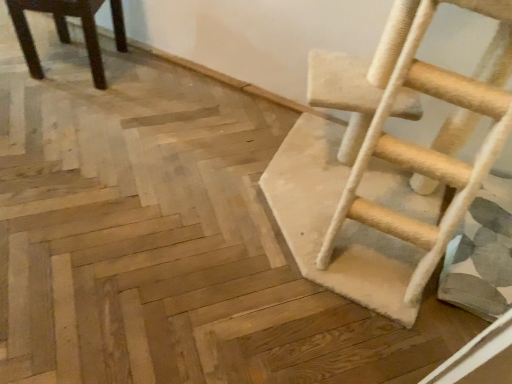
Find the location of `beige carpeted ladder at right`. beige carpeted ladder at right is located at coordinates (418, 146).

Image resolution: width=512 pixels, height=384 pixels. What do you see at coordinates (418, 146) in the screenshot? I see `beige carpeted ladder at right` at bounding box center [418, 146].

In order to face beige carpeted ladder at right, should I rotate leftwards or rightwards?

To face it directly, rotate right by 17.753 degrees.

Image resolution: width=512 pixels, height=384 pixels. I want to click on dark brown wood chair at upper left, so pos(59,31).

Measure the distance between dark brown wood chair at upper left and camera.

A distance of 4.39 feet exists between dark brown wood chair at upper left and camera.

This screenshot has height=384, width=512. Describe the element at coordinates (59, 31) in the screenshot. I see `dark brown wood chair at upper left` at that location.

What are the coordinates of `beige carpeted ladder at right` in the screenshot? It's located at (418, 146).

Is dark brown wood chair at upper left at the left side of beige carpeted ladder at right?

Correct, you'll find dark brown wood chair at upper left to the left of beige carpeted ladder at right.

Is dark brown wood chair at upper left positioned before beige carpeted ladder at right?

That is False.

Which is nearer, (29,59) or (407,234)?

The point (407,234) is in front.

From the image's perspective, is dark brown wood chair at upper left located above beige carpeted ladder at right?

Correct, dark brown wood chair at upper left appears higher than beige carpeted ladder at right in the image.

From a real-world perspective, which object rests below the other?

In real-world perspective, dark brown wood chair at upper left is lower.

Considering the sizes of dark brown wood chair at upper left and beige carpeted ladder at right in the image, is dark brown wood chair at upper left wider or thinner than beige carpeted ladder at right?

Considering their sizes, dark brown wood chair at upper left looks slimmer than beige carpeted ladder at right.

Does dark brown wood chair at upper left have a lesser height compared to beige carpeted ladder at right?

Yes, dark brown wood chair at upper left is shorter than beige carpeted ladder at right.

Considering the sizes of objects dark brown wood chair at upper left and beige carpeted ladder at right in the image provided, who is smaller, dark brown wood chair at upper left or beige carpeted ladder at right?

With smaller size is dark brown wood chair at upper left.

Is dark brown wood chair at upper left inside or outside of beige carpeted ladder at right?

The correct answer is: outside.

Is dark brown wood chair at upper left positioned far away from beige carpeted ladder at right?

Indeed, dark brown wood chair at upper left is not near beige carpeted ladder at right.

Is dark brown wood chair at upper left turned away from beige carpeted ladder at right?

No, dark brown wood chair at upper left's orientation is not away from beige carpeted ladder at right.

How far apart are dark brown wood chair at upper left and beige carpeted ladder at right?

They are 1.06 meters apart.

Locate an element on the screen. This screenshot has height=384, width=512. ladder in front of the dark brown wood chair at upper left is located at coordinates (418, 146).

Which object is positioned more to the left, beige carpeted ladder at right or dark brown wood chair at upper left?

From the viewer's perspective, dark brown wood chair at upper left appears more on the left side.

Is beige carpeted ladder at right closer to the viewer compared to dark brown wood chair at upper left?

That is True.

Is point (490, 143) farther from viewer compared to point (26, 58)?

No, it is in front of (26, 58).

From the image's perspective, which object appears higher, beige carpeted ladder at right or dark brown wood chair at upper left?

dark brown wood chair at upper left appears higher in the image.

From a real-world perspective, is beige carpeted ladder at right above or below dark brown wood chair at upper left?

From a real-world perspective, beige carpeted ladder at right is physically above dark brown wood chair at upper left.

Does beige carpeted ladder at right have a lesser width compared to dark brown wood chair at upper left?

Incorrect, the width of beige carpeted ladder at right is not less than that of dark brown wood chair at upper left.

Considering the relative sizes of beige carpeted ladder at right and dark brown wood chair at upper left in the image provided, is beige carpeted ladder at right taller than dark brown wood chair at upper left?

Yes.

Considering the sizes of objects beige carpeted ladder at right and dark brown wood chair at upper left in the image provided, who is smaller, beige carpeted ladder at right or dark brown wood chair at upper left?

Smaller between the two is dark brown wood chair at upper left.

Which is correct: beige carpeted ladder at right is inside dark brown wood chair at upper left, or outside of it?

beige carpeted ladder at right exists outside the volume of dark brown wood chair at upper left.

Are beige carpeted ladder at right and dark brown wood chair at upper left beside each other?

beige carpeted ladder at right and dark brown wood chair at upper left are not in contact.

Is beige carpeted ladder at right oriented towards dark brown wood chair at upper left?

No.

Consider the image. How much distance is there between beige carpeted ladder at right and dark brown wood chair at upper left?

They are 1.06 meters apart.

I want to click on ladder that is below the dark brown wood chair at upper left (from the image's perspective), so click(x=418, y=146).

Locate an element on the screen. This screenshot has height=384, width=512. ladder that is above the dark brown wood chair at upper left (from a real-world perspective) is located at coordinates (418, 146).

The height and width of the screenshot is (384, 512). In order to click on chair above the beige carpeted ladder at right (from the image's perspective) in this screenshot , I will do `click(59, 31)`.